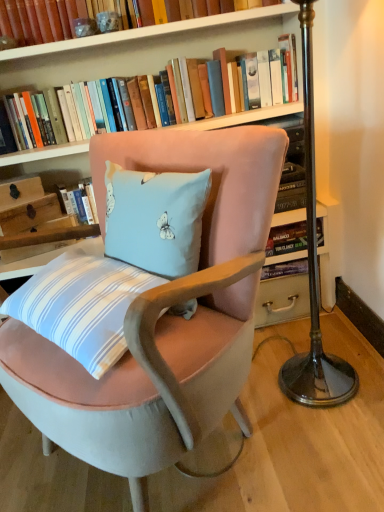
Based on the photo, measure the distance between matte wooden drawer at upper left, which appears as the 2th drawer when ordered from the bottom, and camera.

matte wooden drawer at upper left, which appears as the 2th drawer when ordered from the bottom, is 1.51 meters away from camera.

This screenshot has width=384, height=512. What do you see at coordinates (29, 214) in the screenshot?
I see `wooden drawer at left, the first drawer ordered from the bottom` at bounding box center [29, 214].

Describe the element at coordinates (163, 319) in the screenshot. This screenshot has width=384, height=512. I see `velvet pink chair at center` at that location.

You are a GUI agent. You are given a task and a screenshot of the screen. Output one action in this format:
    pyautogui.click(x=<x>, y=<y>)
    Task: Click on the velvet pink chair at center
    The image size is (384, 512).
    Given the screenshot: What is the action you would take?
    coord(163,319)

Find the location of a particular element. The width and height of the screenshot is (384, 512). matte wooden drawer at upper left, the first drawer from the top is located at coordinates (20, 191).

From a real-world perspective, which object stands above the other?

From a 3D spatial view, hardcover books at upper center, which appears as the first book when ordered from the bottom, is above.

Which of these two, hardcover books at upper center, which appears as the first book when ordered from the bottom, or wooden drawer at left, the first drawer ordered from the bottom, stands taller?

Standing taller between the two is hardcover books at upper center, which appears as the first book when ordered from the bottom.

Is hardcover books at upper center, the second book when ordered from top to bottom, in front of or behind wooden drawer at left, the first drawer ordered from the bottom, in the image?

Clearly, hardcover books at upper center, the second book when ordered from top to bottom, is in front of wooden drawer at left, the first drawer ordered from the bottom.

Between hardcover books at upper center, which appears as the first book when ordered from the bottom, and wooden drawer at left, the first drawer ordered from the bottom, which one has smaller size?

Smaller between the two is wooden drawer at left, the first drawer ordered from the bottom.

Find the location of `the 1st drawer counting from the left side of the hardcover book at upper center, the second book ordered from the bottom`. the 1st drawer counting from the left side of the hardcover book at upper center, the second book ordered from the bottom is located at coordinates (29, 214).

Does wooden drawer at left, which ranks as the 2th drawer in top-to-bottom order, have a lesser height compared to hardcover book at upper center, the second book ordered from the bottom?

Indeed, wooden drawer at left, which ranks as the 2th drawer in top-to-bottom order, has a lesser height compared to hardcover book at upper center, the second book ordered from the bottom.

Based on the photo, is wooden drawer at left, the first drawer ordered from the bottom, spatially inside hardcover book at upper center, which appears as the 1th book when viewed from the top, or outside of it?

wooden drawer at left, the first drawer ordered from the bottom, is outside hardcover book at upper center, which appears as the 1th book when viewed from the top.

Is wooden drawer at left, the first drawer ordered from the bottom, bigger than hardcover book at upper center, the second book ordered from the bottom?

Actually, wooden drawer at left, the first drawer ordered from the bottom, might be smaller than hardcover book at upper center, the second book ordered from the bottom.

Looking at this image, from a real-world perspective, which is physically below, matte wooden drawer at upper left, the first drawer from the top, or hardcover book at upper center, which appears as the 1th book when viewed from the top?

matte wooden drawer at upper left, the first drawer from the top.

Is matte wooden drawer at upper left, which appears as the 2th drawer when ordered from the bottom, at the right side of hardcover book at upper center, which appears as the 1th book when viewed from the top?

No, matte wooden drawer at upper left, which appears as the 2th drawer when ordered from the bottom, is not to the right of hardcover book at upper center, which appears as the 1th book when viewed from the top.

Considering the positions of points (25, 196) and (32, 40), is point (25, 196) closer to camera compared to point (32, 40)?

No, it is not.

Would you say matte wooden drawer at upper left, which appears as the 2th drawer when ordered from the bottom, is inside or outside hardcover book at upper center, the second book ordered from the bottom?

matte wooden drawer at upper left, which appears as the 2th drawer when ordered from the bottom, is spatially situated outside hardcover book at upper center, the second book ordered from the bottom.

Is hardcover books at upper center, which appears as the first book when ordered from the bottom, bigger than velvet pink chair at center?

No.

Considering the relative sizes of hardcover books at upper center, which appears as the first book when ordered from the bottom, and velvet pink chair at center in the image provided, is hardcover books at upper center, which appears as the first book when ordered from the bottom, taller than velvet pink chair at center?

No.

Is hardcover books at upper center, which appears as the first book when ordered from the bottom, outside of velvet pink chair at center?

hardcover books at upper center, which appears as the first book when ordered from the bottom, lies outside velvet pink chair at center's area.

From the image's perspective, relative to velvet pink chair at center, is hardcover books at upper center, which appears as the first book when ordered from the bottom, above or below?

From the image's perspective, hardcover books at upper center, which appears as the first book when ordered from the bottom, appears above velvet pink chair at center.

Is point (28, 27) closer to camera compared to point (4, 183)?

That is True.

Is hardcover book at upper center, the second book ordered from the bottom, taller or shorter than matte wooden drawer at upper left, which appears as the 2th drawer when ordered from the bottom?

hardcover book at upper center, the second book ordered from the bottom, is taller than matte wooden drawer at upper left, which appears as the 2th drawer when ordered from the bottom.

Starting from the hardcover book at upper center, which appears as the 1th book when viewed from the top, which drawer is the 2nd one behind? Please provide its 2D coordinates.

[(20, 191)]

Based on the photo, is hardcover book at upper center, the second book ordered from the bottom, positioned before matte wooden drawer at upper left, which appears as the 2th drawer when ordered from the bottom?

Yes, the depth of hardcover book at upper center, the second book ordered from the bottom, is less than that of matte wooden drawer at upper left, which appears as the 2th drawer when ordered from the bottom.

How distant is hardcover books at upper center, which appears as the first book when ordered from the bottom, from hardcover book at upper center, the second book ordered from the bottom?

The distance of hardcover books at upper center, which appears as the first book when ordered from the bottom, from hardcover book at upper center, the second book ordered from the bottom, is 17.85 inches.

At what (x,y) coordinates should I click in order to perform the action: click on book that appears in front of the hardcover books at upper center, which appears as the first book when ordered from the bottom. Please return your answer as a coordinate pair (x, y). The image size is (384, 512). Looking at the image, I should click on (27, 22).

Is there a large distance between hardcover books at upper center, the second book when ordered from top to bottom, and hardcover book at upper center, the second book ordered from the bottom?

hardcover books at upper center, the second book when ordered from top to bottom, is near hardcover book at upper center, the second book ordered from the bottom, not far away.

In the scene shown: Is hardcover books at upper center, which appears as the first book when ordered from the bottom, looking in the opposite direction of hardcover book at upper center, the second book ordered from the bottom?

No, hardcover books at upper center, which appears as the first book when ordered from the bottom, is not facing the opposite direction of hardcover book at upper center, the second book ordered from the bottom.

Does matte wooden drawer at upper left, the first drawer from the top, have a lesser width compared to wooden drawer at left, which ranks as the 2th drawer in top-to-bottom order?

Indeed, matte wooden drawer at upper left, the first drawer from the top, has a lesser width compared to wooden drawer at left, which ranks as the 2th drawer in top-to-bottom order.

Is matte wooden drawer at upper left, which appears as the 2th drawer when ordered from the bottom, bigger or smaller than wooden drawer at left, which ranks as the 2th drawer in top-to-bottom order?

Clearly, matte wooden drawer at upper left, which appears as the 2th drawer when ordered from the bottom, is smaller in size than wooden drawer at left, which ranks as the 2th drawer in top-to-bottom order.

Which of these two, matte wooden drawer at upper left, the first drawer from the top, or wooden drawer at left, which ranks as the 2th drawer in top-to-bottom order, stands taller?

Standing taller between the two is wooden drawer at left, which ranks as the 2th drawer in top-to-bottom order.

From the image's perspective, which book is the 1st one above the wooden drawer at left, which ranks as the 2th drawer in top-to-bottom order? Please provide its 2D coordinates.

[(244, 117)]

Starting from the wooden drawer at left, which ranks as the 2th drawer in top-to-bottom order, which book is the 2nd one to the right? Please provide its 2D coordinates.

[(27, 22)]

Which object lies nearer to the anchor point velvet pink chair at center, hardcover book at upper center, which appears as the 1th book when viewed from the top, or hardcover books at upper center, which appears as the first book when ordered from the bottom?

hardcover books at upper center, which appears as the first book when ordered from the bottom, is closer to velvet pink chair at center.

Estimate the real-world distances between objects in this image. Which object is closer to hardcover books at upper center, which appears as the first book when ordered from the bottom, velvet pink chair at center or matte wooden drawer at upper left, the first drawer from the top?

The object closer to hardcover books at upper center, which appears as the first book when ordered from the bottom, is matte wooden drawer at upper left, the first drawer from the top.

From the image, which object appears to be farther from hardcover book at upper center, which appears as the 1th book when viewed from the top, velvet pink chair at center or matte wooden drawer at upper left, which appears as the 2th drawer when ordered from the bottom?

velvet pink chair at center is positioned further to the anchor hardcover book at upper center, which appears as the 1th book when viewed from the top.

When comparing their distances from matte wooden drawer at upper left, which appears as the 2th drawer when ordered from the bottom, does hardcover books at upper center, which appears as the first book when ordered from the bottom, or hardcover book at upper center, the second book ordered from the bottom, seem further?

Based on the image, hardcover book at upper center, the second book ordered from the bottom, appears to be further to matte wooden drawer at upper left, which appears as the 2th drawer when ordered from the bottom.

From the image, which object appears to be nearer to hardcover books at upper center, the second book when ordered from top to bottom, wooden drawer at left, which ranks as the 2th drawer in top-to-bottom order, or matte wooden drawer at upper left, the first drawer from the top?

wooden drawer at left, which ranks as the 2th drawer in top-to-bottom order, lies closer to hardcover books at upper center, the second book when ordered from top to bottom, than the other object.

From the image, which object appears to be farther from wooden drawer at left, the first drawer ordered from the bottom, velvet pink chair at center or hardcover books at upper center, which appears as the first book when ordered from the bottom?

velvet pink chair at center is positioned further to the anchor wooden drawer at left, the first drawer ordered from the bottom.

Looking at the image, which one is located further to matte wooden drawer at upper left, which appears as the 2th drawer when ordered from the bottom, hardcover book at upper center, the second book ordered from the bottom, or velvet pink chair at center?

velvet pink chair at center is positioned further to the anchor matte wooden drawer at upper left, which appears as the 2th drawer when ordered from the bottom.

When comparing their distances from wooden drawer at left, the first drawer ordered from the bottom, does hardcover books at upper center, which appears as the first book when ordered from the bottom, or hardcover book at upper center, the second book ordered from the bottom, seem closer?

Among the two, hardcover books at upper center, which appears as the first book when ordered from the bottom, is located nearer to wooden drawer at left, the first drawer ordered from the bottom.

Find the location of `book between velvet pink chair at center and hardcover books at upper center, the second book when ordered from top to bottom, in the front-back direction`. book between velvet pink chair at center and hardcover books at upper center, the second book when ordered from top to bottom, in the front-back direction is located at coordinates (27, 22).

Identify the location of drawer located between velvet pink chair at center and matte wooden drawer at upper left, the first drawer from the top, in the depth direction. (29, 214).

Image resolution: width=384 pixels, height=512 pixels. Identify the location of drawer between hardcover book at upper center, which appears as the 1th book when viewed from the top, and wooden drawer at left, which ranks as the 2th drawer in top-to-bottom order, vertically. (20, 191).

Where is `drawer located between matte wooden drawer at upper left, the first drawer from the top, and hardcover books at upper center, which appears as the first book when ordered from the bottom, in the left-right direction`? drawer located between matte wooden drawer at upper left, the first drawer from the top, and hardcover books at upper center, which appears as the first book when ordered from the bottom, in the left-right direction is located at coordinates (29, 214).